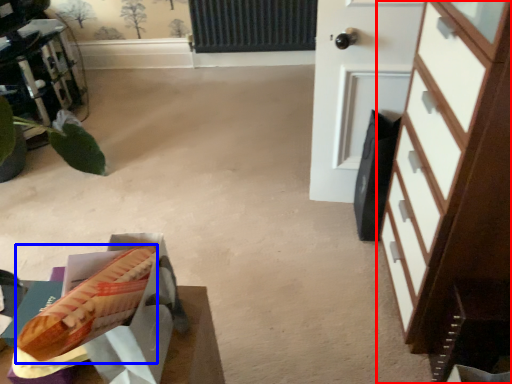
Question: Which object appears closest to the camera in this image, chest of drawers (highlighted by a red box) or hot dog (highlighted by a blue box)?

Choices:
 (A) chest of drawers
 (B) hot dog

Answer: (A)